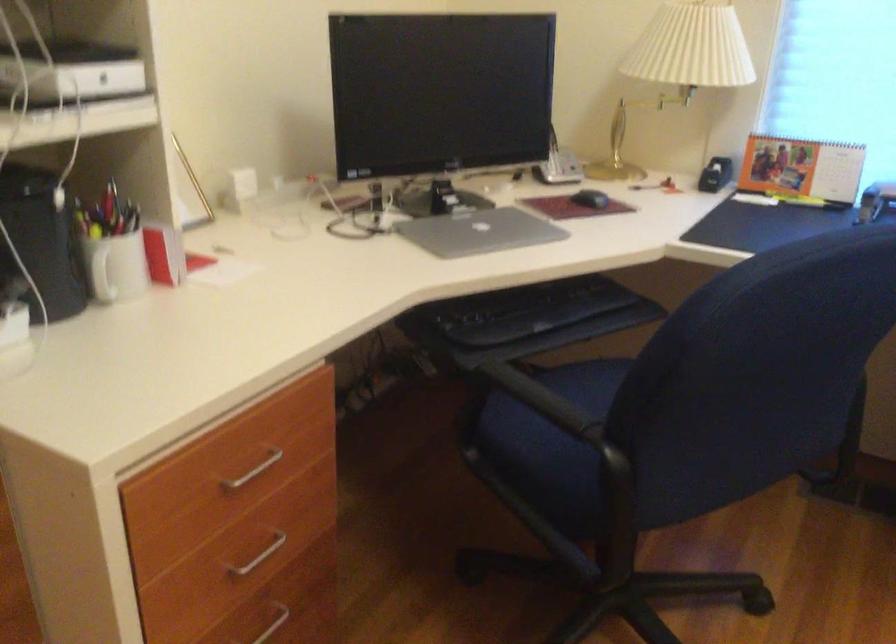
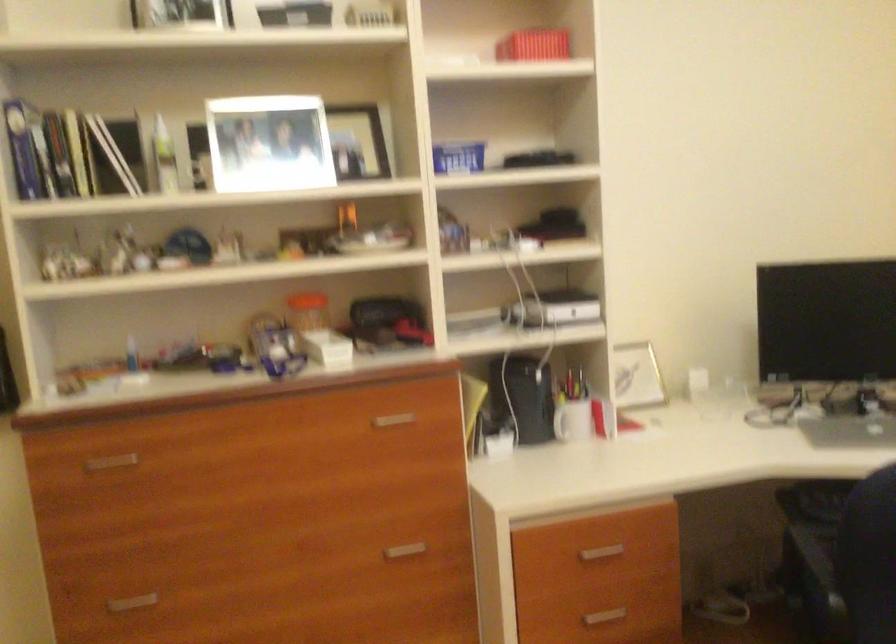
Locate, in the second image, the point that corresponds to the point at 224,469 in the first image.

(600, 553)